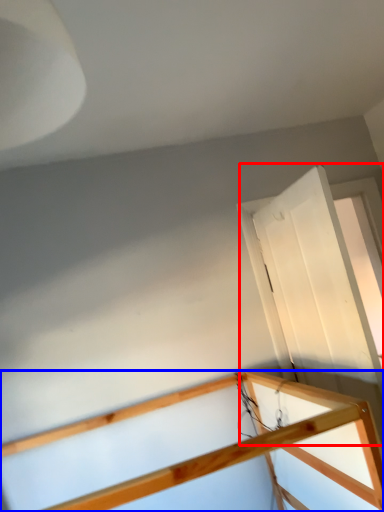
Question: Which of the following is the closest to the observer, glass door (highlighted by a red box) or rail (highlighted by a blue box)?

Choices:
 (A) glass door
 (B) rail

Answer: (B)